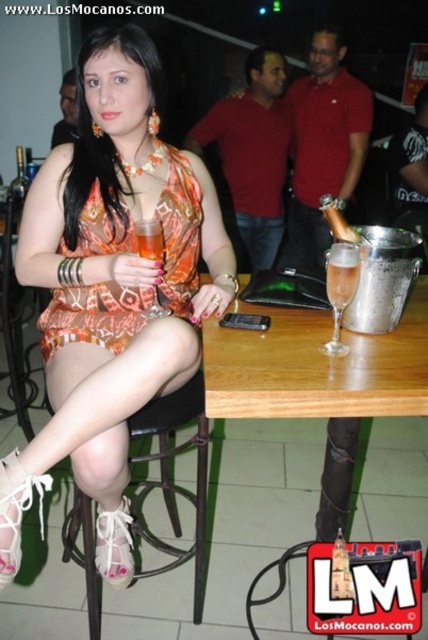
Can you confirm if wooden table at center is wider than orange printed fabric dress at center?

Correct, the width of wooden table at center exceeds that of orange printed fabric dress at center.

Between wooden table at center and orange printed fabric dress at center, which one has more height?

wooden table at center

This screenshot has height=640, width=428. What do you see at coordinates (320, 384) in the screenshot? I see `wooden table at center` at bounding box center [320, 384].

Image resolution: width=428 pixels, height=640 pixels. What are the coordinates of `wooden table at center` in the screenshot? It's located at [320, 384].

Does black leather bar stool at lower left appear on the right side of clear glass champagne flute at table center?

Incorrect, black leather bar stool at lower left is not on the right side of clear glass champagne flute at table center.

Between point (168, 449) and point (332, 296), which one is positioned in front?

Positioned in front is point (332, 296).

This screenshot has height=640, width=428. In order to click on black leather bar stool at lower left in this screenshot , I will do `click(172, 477)`.

Who is lower down, black leather bar stool at lower left or translucent glass at center?

black leather bar stool at lower left is below.

What are the coordinates of `black leather bar stool at lower left` in the screenshot? It's located at (172, 477).

You are a GUI agent. You are given a task and a screenshot of the screen. Output one action in this format:
    pyautogui.click(x=<x>, y=<y>)
    Task: Click on the black leather bar stool at lower left
    Image resolution: width=428 pixels, height=640 pixels.
    Given the screenshot: What is the action you would take?
    pyautogui.click(x=172, y=477)